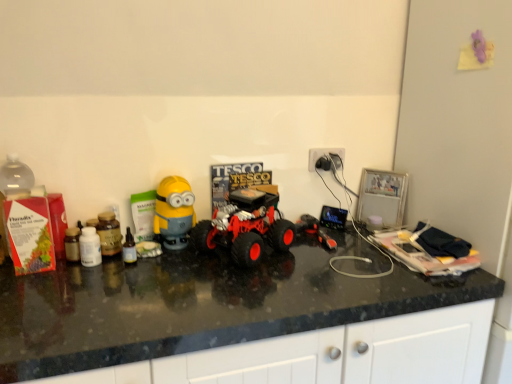
Where is `free point in front of rubberized red monster truck at center, which is counted as the second toy, starting from the left`? The image size is (512, 384). free point in front of rubberized red monster truck at center, which is counted as the second toy, starting from the left is located at coordinates (245, 289).